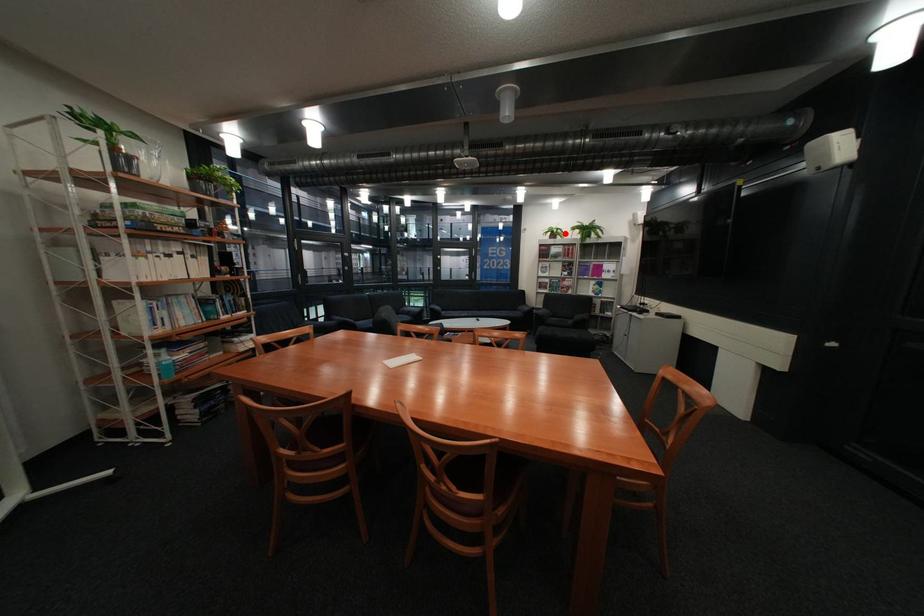
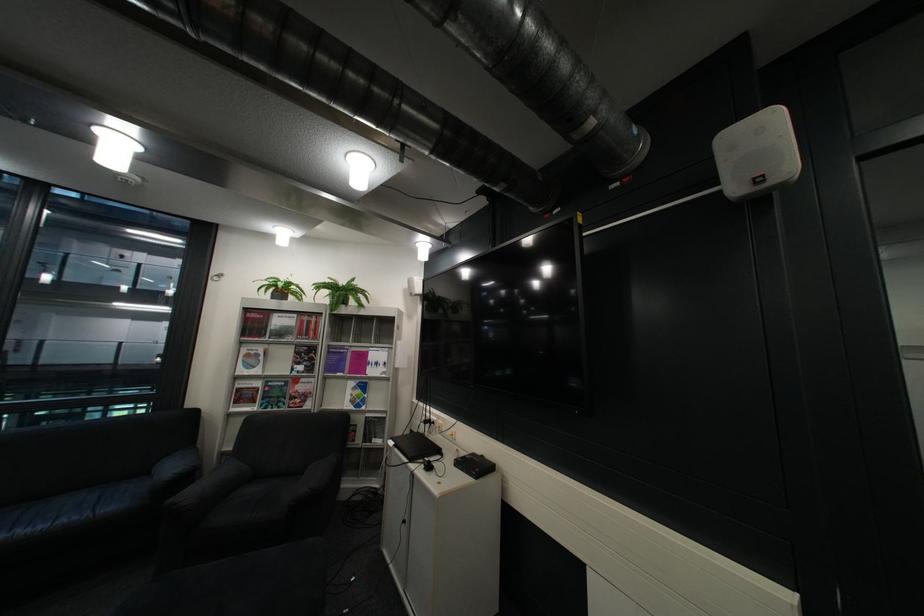
Where in the second image is the point corresponding to the highlighted location from the first image?

(287, 290)